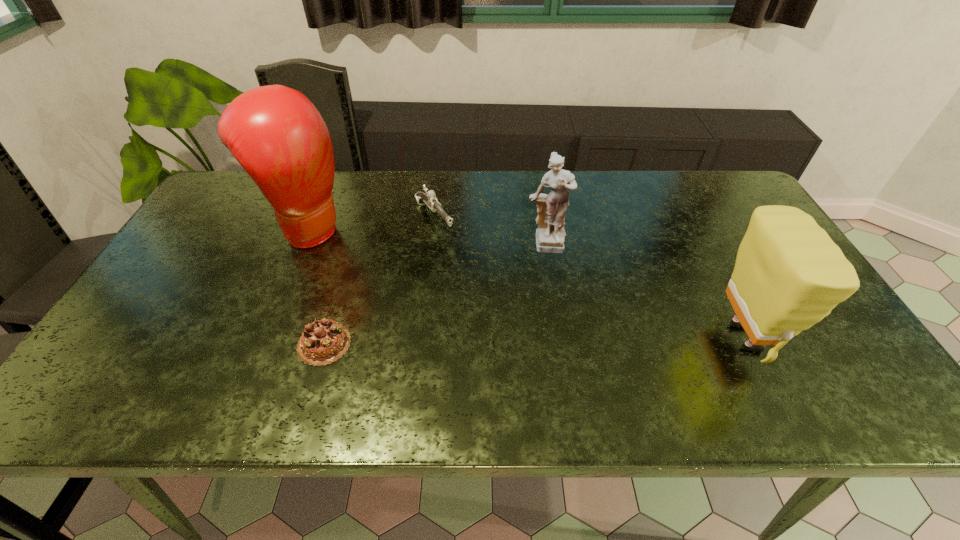
Where is `sponge that is at the near edge`? The image size is (960, 540). sponge that is at the near edge is located at coordinates (789, 274).

In the image, there is a desktop. At what (x,y) coordinates should I click in order to perform the action: click on free space at the far edge. Please return your answer as a coordinate pair (x, y). The width and height of the screenshot is (960, 540). Looking at the image, I should click on (439, 194).

Image resolution: width=960 pixels, height=540 pixels. In the image, there is a desktop. Identify the location of vacant space at the near edge. (400, 357).

In the image, there is a desktop. Where is `vacant space at the left edge`? This screenshot has height=540, width=960. vacant space at the left edge is located at coordinates (216, 237).

This screenshot has width=960, height=540. I want to click on blank space at the far left corner of the desktop, so click(260, 194).

Image resolution: width=960 pixels, height=540 pixels. In order to click on free spot at the far right corner of the desktop in this screenshot , I will do `click(723, 174)`.

The image size is (960, 540). What are the coordinates of `free space between the third object from left to right and the second object from right to left` in the screenshot? It's located at (490, 233).

You are a GUI agent. You are given a task and a screenshot of the screen. Output one action in this format:
    pyautogui.click(x=<x>, y=<y>)
    Task: Click on the vacant area between the shortest object and the boxing glove
    The height and width of the screenshot is (540, 960).
    Given the screenshot: What is the action you would take?
    pyautogui.click(x=317, y=286)

The width and height of the screenshot is (960, 540). I want to click on vacant point located between the figurine and the chocolate cake, so click(435, 295).

Where is `vacant area that lies between the chocolate cake and the second object from right to left`? This screenshot has height=540, width=960. vacant area that lies between the chocolate cake and the second object from right to left is located at coordinates (435, 295).